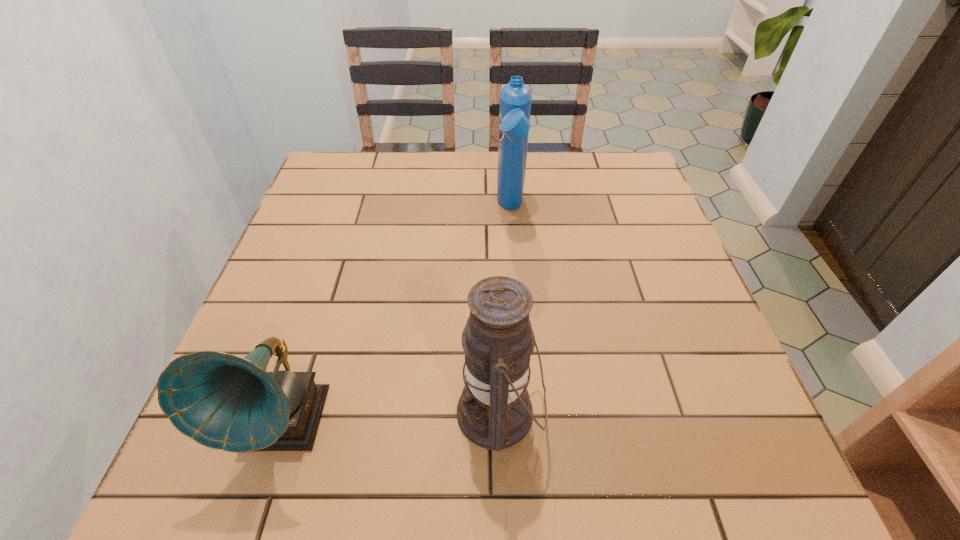
You are a GUI agent. You are given a task and a screenshot of the screen. Output one action in this format:
    pyautogui.click(x=<x>, y=<y>)
    Task: Click on the vacant point located between the shortest object and the oil lamp
    This screenshot has height=540, width=960.
    Given the screenshot: What is the action you would take?
    pyautogui.click(x=392, y=418)

The image size is (960, 540). I want to click on unoccupied area between the leftmost object and the farthest object, so click(x=397, y=316).

Image resolution: width=960 pixels, height=540 pixels. What are the coordinates of `the closest object to the leftmost object` in the screenshot? It's located at (494, 411).

The height and width of the screenshot is (540, 960). Find the location of `object that is the closest one to the oil lamp`. object that is the closest one to the oil lamp is located at coordinates (222, 401).